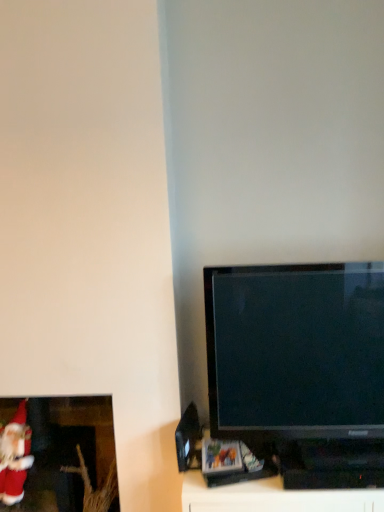
This screenshot has width=384, height=512. What do you see at coordinates (57, 455) in the screenshot?
I see `matte red santa at lower left` at bounding box center [57, 455].

This screenshot has height=512, width=384. Describe the element at coordinates (15, 456) in the screenshot. I see `velvet red santa claus at lower left` at that location.

Identify the location of velvet red santa claus at lower left. Image resolution: width=384 pixels, height=512 pixels. pos(15,456).

Where is `matte red santa at lower left`? matte red santa at lower left is located at coordinates (57, 455).

Is black glossy tv at right positioned in front of matte red santa at lower left?

Yes.

Considering the relative sizes of black glossy tv at right and matte red santa at lower left in the image provided, is black glossy tv at right shorter than matte red santa at lower left?

Indeed, black glossy tv at right has a lesser height compared to matte red santa at lower left.

Looking at the image, does black glossy tv at right seem bigger or smaller compared to matte red santa at lower left?

In the image, black glossy tv at right appears to be smaller than matte red santa at lower left.

What's the angular difference between black glossy tv at right and matte red santa at lower left's facing directions?

1.72 degrees.

Which object is positioned more to the left, velvet red santa claus at lower left or black glossy tv at right?

Positioned to the left is velvet red santa claus at lower left.

Where is `santa claus below the black glossy tv at right (from the image's perspective)`? Image resolution: width=384 pixels, height=512 pixels. santa claus below the black glossy tv at right (from the image's perspective) is located at coordinates (15, 456).

Could black glossy tv at right be considered to be inside velvet red santa claus at lower left?

No, black glossy tv at right is not surrounded by velvet red santa claus at lower left.

From a real-world perspective, which object rests below the other?

From a 3D spatial view, velvet red santa claus at lower left is below.

The height and width of the screenshot is (512, 384). Find the location of `santa claus in front of the matte red santa at lower left`. santa claus in front of the matte red santa at lower left is located at coordinates (15, 456).

Would you say velvet red santa claus at lower left is inside or outside matte red santa at lower left?

velvet red santa claus at lower left lies within the bounds of matte red santa at lower left.

Between velvet red santa claus at lower left and matte red santa at lower left, which one is positioned behind?

matte red santa at lower left is behind.

Is velvet red santa claus at lower left aimed at matte red santa at lower left?

Yes, velvet red santa claus at lower left is oriented towards matte red santa at lower left.

Are matte red santa at lower left and black glossy tv at right far apart?

No, matte red santa at lower left is in close proximity to black glossy tv at right.

Does matte red santa at lower left turn towards black glossy tv at right?

No, matte red santa at lower left does not turn towards black glossy tv at right.

Who is smaller, matte red santa at lower left or black glossy tv at right?

black glossy tv at right.

Is matte red santa at lower left to the right of black glossy tv at right from the viewer's perspective?

In fact, matte red santa at lower left is to the left of black glossy tv at right.

Are matte red santa at lower left and velvet red santa claus at lower left far apart?

They are positioned close to each other.

Would you say matte red santa at lower left is to the left or to the right of velvet red santa claus at lower left in the picture?

matte red santa at lower left is positioned on velvet red santa claus at lower left's right side.

Find the location of `santa claus on the left of the matte red santa at lower left`. santa claus on the left of the matte red santa at lower left is located at coordinates (15, 456).

Is velvet red santa claus at lower left at the back of matte red santa at lower left?

Yes, matte red santa at lower left is facing away from velvet red santa claus at lower left.

From a real-world perspective, is black glossy tv at right physically above velvet red santa claus at lower left?

Correct, in the physical world, black glossy tv at right is higher than velvet red santa claus at lower left.

Measure the distance from black glossy tv at right to velvet red santa claus at lower left.

black glossy tv at right and velvet red santa claus at lower left are 1.01 meters apart.

Is the depth of black glossy tv at right less than that of velvet red santa claus at lower left?

Yes, it is.

Is black glossy tv at right outside of velvet red santa claus at lower left?

black glossy tv at right is positioned outside velvet red santa claus at lower left.

What are the coordinates of `television above the matte red santa at lower left (from a real-world perspective)` in the screenshot? It's located at (300, 368).

Where is `santa claus that is behind the black glossy tv at right`? The height and width of the screenshot is (512, 384). santa claus that is behind the black glossy tv at right is located at coordinates coord(15,456).

Consider the image. Looking at the image, which one is located closer to velvet red santa claus at lower left, black glossy tv at right or matte red santa at lower left?

matte red santa at lower left.

From the image, which object appears to be nearer to black glossy tv at right, velvet red santa claus at lower left or matte red santa at lower left?

matte red santa at lower left is positioned closer to the anchor black glossy tv at right.

From the image, which object appears to be nearer to matte red santa at lower left, velvet red santa claus at lower left or black glossy tv at right?

The object closer to matte red santa at lower left is velvet red santa claus at lower left.

From the image, which object appears to be farther from matte red santa at lower left, black glossy tv at right or velvet red santa claus at lower left?

Based on the image, black glossy tv at right appears to be further to matte red santa at lower left.

Which object lies further to the anchor point velvet red santa claus at lower left, matte red santa at lower left or black glossy tv at right?

black glossy tv at right is further to velvet red santa claus at lower left.

Consider the image. Based on their spatial positions, is matte red santa at lower left or velvet red santa claus at lower left further from black glossy tv at right?

velvet red santa claus at lower left is further to black glossy tv at right.

At what (x,y) coordinates should I click in order to perform the action: click on picture frame situated between velvet red santa claus at lower left and black glossy tv at right from left to right. Please return your answer as a coordinate pair (x, y). This screenshot has width=384, height=512. Looking at the image, I should click on (57, 455).